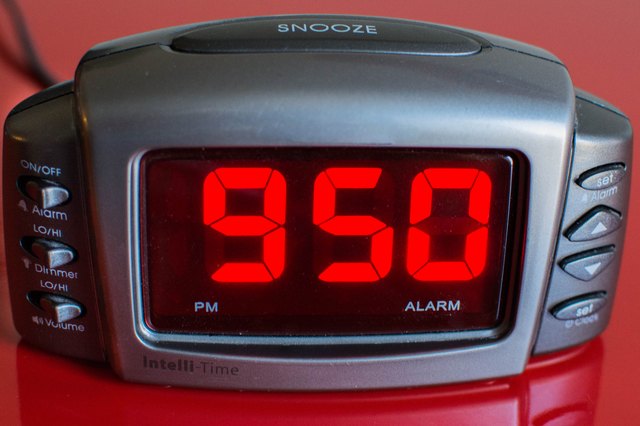
Locate an element on the screen. clock is located at coordinates (228, 95).